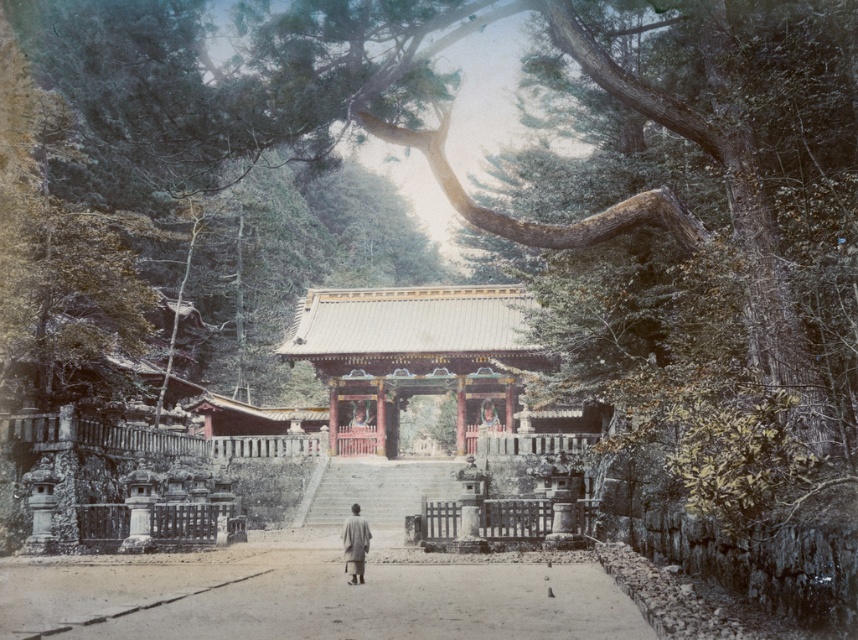
Can you confirm if smooth sand path at center is positioned above gray woolen robe at center?

Yes, smooth sand path at center is above gray woolen robe at center.

Who is more distant from viewer, (71, 636) or (361, 557)?

The point (361, 557) is behind.

Find the location of a particular element. Image resolution: width=858 pixels, height=640 pixels. smooth sand path at center is located at coordinates (313, 600).

Find the location of a particular element. smooth sand path at center is located at coordinates (313, 600).